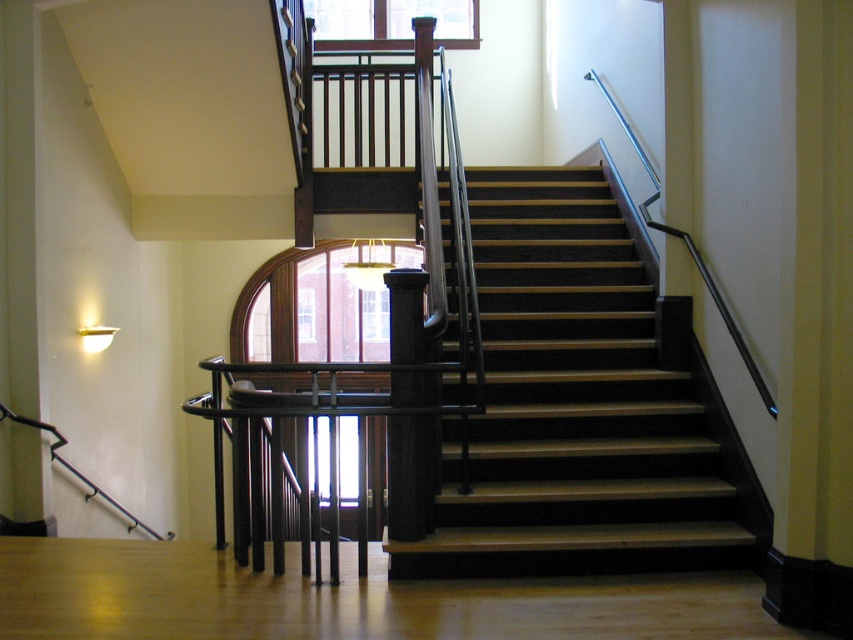
In the scene shown: You are an interior designer planning to place a large sculpture in this staircase area. The sculpture requires a space that can accommodate its base, which is wider than the black polished wood pillar at center. Based on the scene, can the wooden stairs at center provide enough space for the sculpture?

The wooden stairs at center has a larger size compared to the black polished wood pillar at center, so the sculpture can fit as the stairs provide sufficient space for the sculpture base.

You are standing at the bottom of the wooden stairs at center and want to reach the landing area above. Can you step onto the black polished wood pillar at center to climb further?

The wooden stairs at center are positioned over the black polished wood pillar at center, so stepping onto the pillar is not necessary as the stairs themselves provide the path to the landing area.

You are a delivery person carrying a heavy box and need to ascend the wooden stairs at center. Considering the distance from your current position to the stairs, is it feasible to proceed without needing to rest?

The distance between you and the wooden stairs at center is 3.47 meters, which is a short distance. Therefore, it is feasible to proceed without needing to rest.